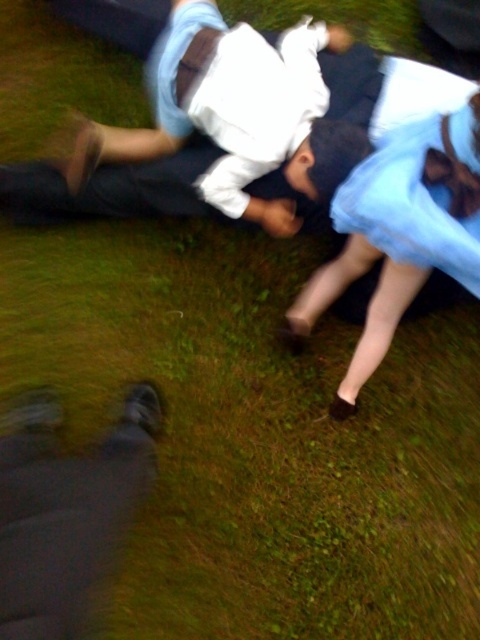
Locate an element on the screen. The width and height of the screenshot is (480, 640). light blue satin dress at center is located at coordinates (397, 234).

Does light blue satin dress at center come in front of light blue satin dress at upper right?

Yes.

Does point (346, 188) come in front of point (396, 221)?

No.

Locate an element on the screen. This screenshot has width=480, height=640. light blue satin dress at center is located at coordinates (397, 234).

Does dark gray pants at lower left appear under light blue satin dress at center?

Indeed, dark gray pants at lower left is positioned under light blue satin dress at center.

Which of these two, dark gray pants at lower left or light blue satin dress at center, stands taller?

Standing taller between the two is light blue satin dress at center.

Which is behind, point (48, 499) or point (427, 253)?

The point (427, 253) is more distant.

Find the location of a particular element. dark gray pants at lower left is located at coordinates (67, 513).

Does dark gray pants at lower left have a greater width compared to light blue satin dress at upper right?

Indeed, dark gray pants at lower left has a greater width compared to light blue satin dress at upper right.

Does point (115, 476) lie behind point (345, 292)?

No, (115, 476) is in front of (345, 292).

Where is `dark gray pants at lower left`? Image resolution: width=480 pixels, height=640 pixels. dark gray pants at lower left is located at coordinates (67, 513).

Locate an element on the screen. dark gray pants at lower left is located at coordinates (67, 513).